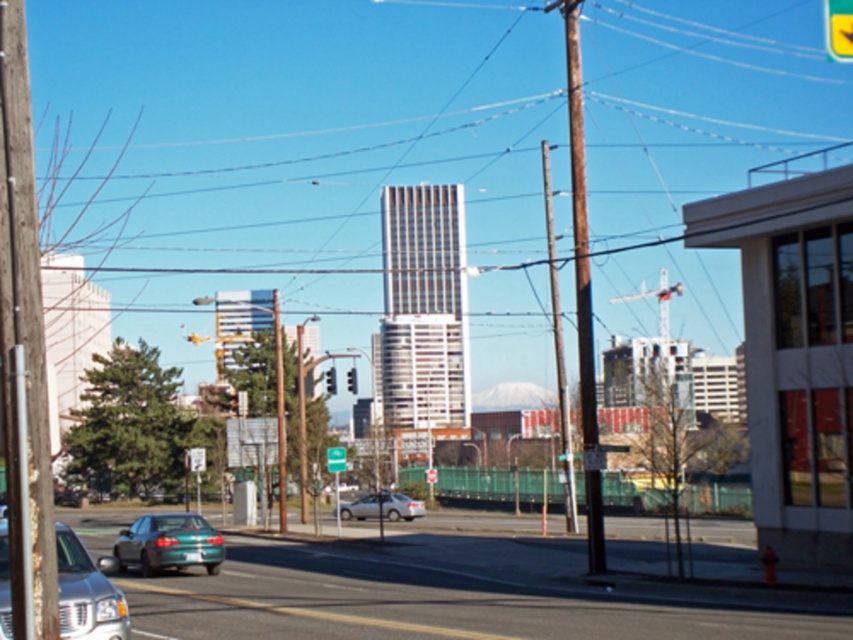
Question: From the image, what is the correct spatial relationship of brown wooden telegraph pole at center in relation to silver metallic sedan at center?

Choices:
 (A) left
 (B) right

Answer: (B)

Question: Which point is closer to the camera taking this photo?

Choices:
 (A) (354, 376)
 (B) (102, 579)
 (C) (834, 1)

Answer: (B)

Question: Among these points, which one is nearest to the camera?

Choices:
 (A) (329, 448)
 (B) (85, 637)
 (C) (843, 28)
 (D) (329, 385)

Answer: (B)

Question: Which point is closer to the camera?

Choices:
 (A) (328, 467)
 (B) (350, 381)
 (C) (328, 387)
 (D) (178, 529)

Answer: (D)

Question: Does teal glossy sedan at lower left have a lesser width compared to red glass traffic light at center?

Choices:
 (A) yes
 (B) no

Answer: (A)

Question: Can you confirm if silver metallic sedan at center is positioned below green plastic sign at upper center?

Choices:
 (A) no
 (B) yes

Answer: (B)